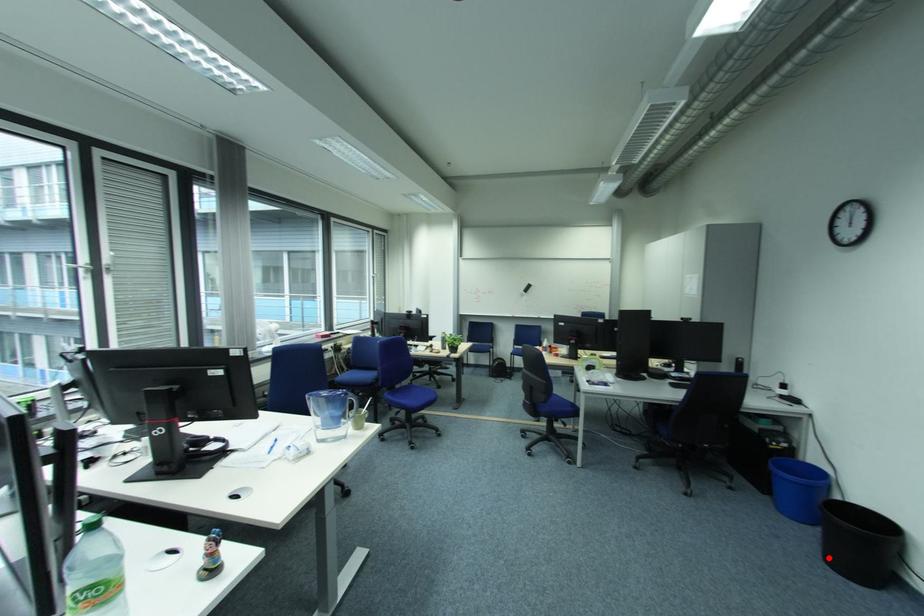
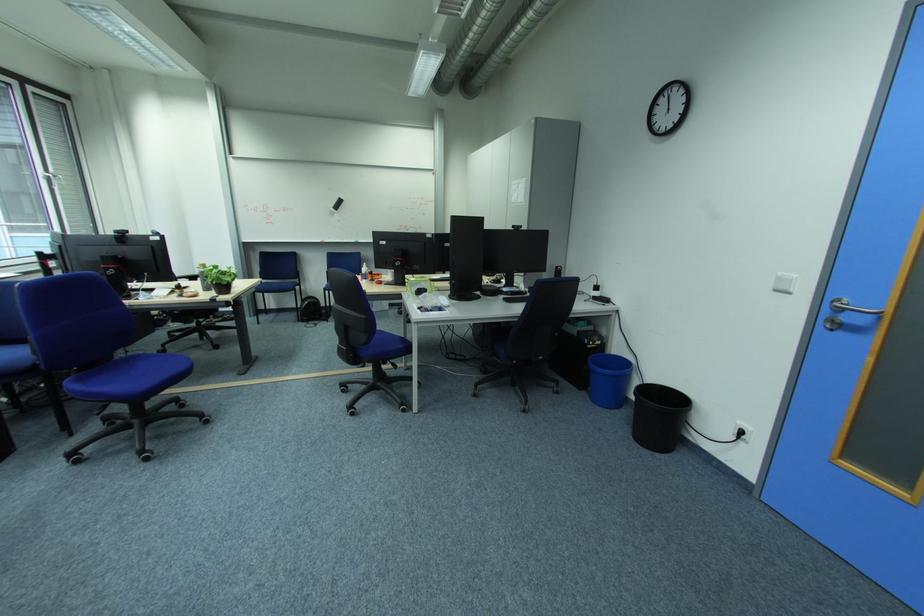
Question: A red point is marked in image1. In image2, is the corresponding 3D point closer to the camera or farther? Reply with the corresponding letter.

Choices:
 (A) The corresponding 3D point is closer.
 (B) The corresponding 3D point is farther.

Answer: (A)